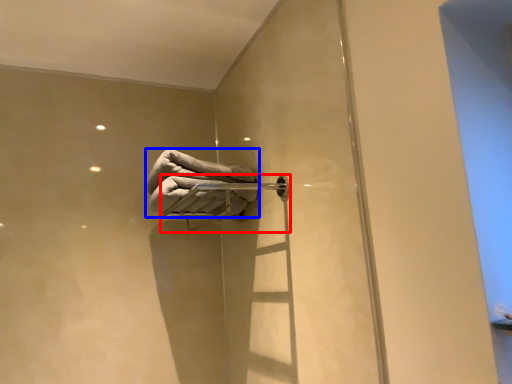
Question: Which of the following is the closest to the observer, towel bar (highlighted by a red box) or towel (highlighted by a blue box)?

Choices:
 (A) towel bar
 (B) towel

Answer: (A)